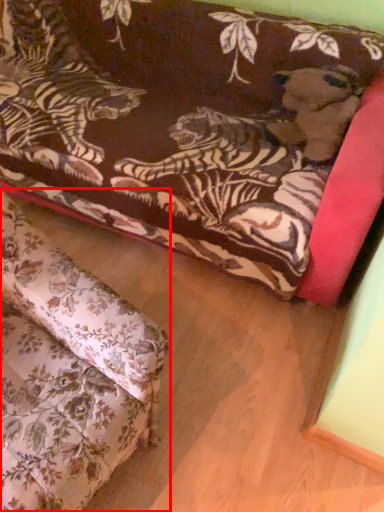
Question: From the image's perspective, where is studio couch (annotated by the red box) located relative to studio couch?

Choices:
 (A) above
 (B) below

Answer: (B)